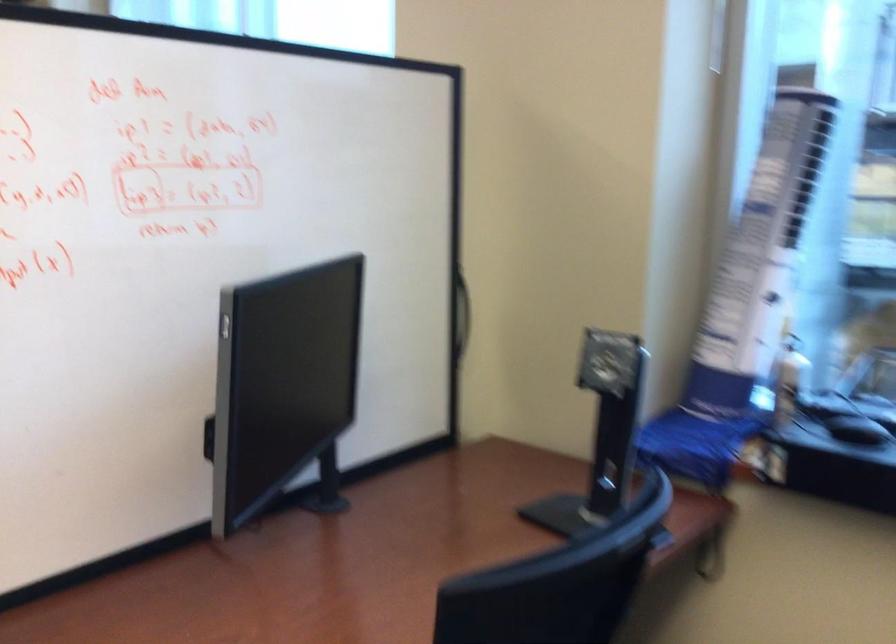
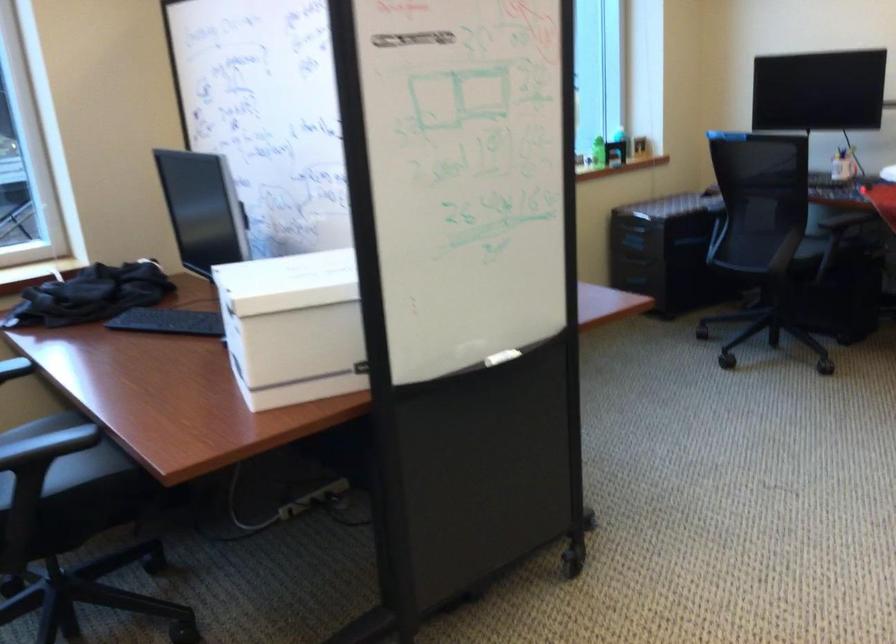
Question: I am providing you with two images of the same scene from different viewpoints. Which of the following objects are not visible in image2?

Choices:
 (A) black monitor stand
 (B) whiteboard marker tray
 (C) wooden sitting surface
 (D) green plastic bottle

Answer: (A)